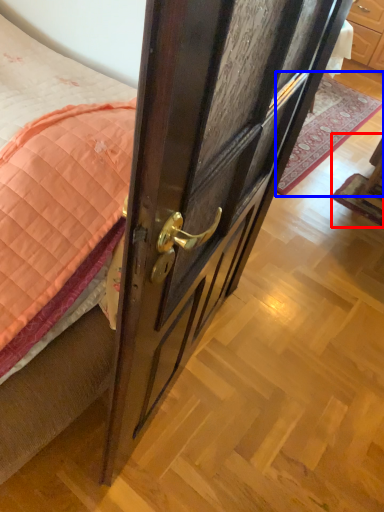
Question: Among these objects, which one is nearest to the camera, furniture (highlighted by a red box) or plain (highlighted by a blue box)?

Choices:
 (A) furniture
 (B) plain

Answer: (A)